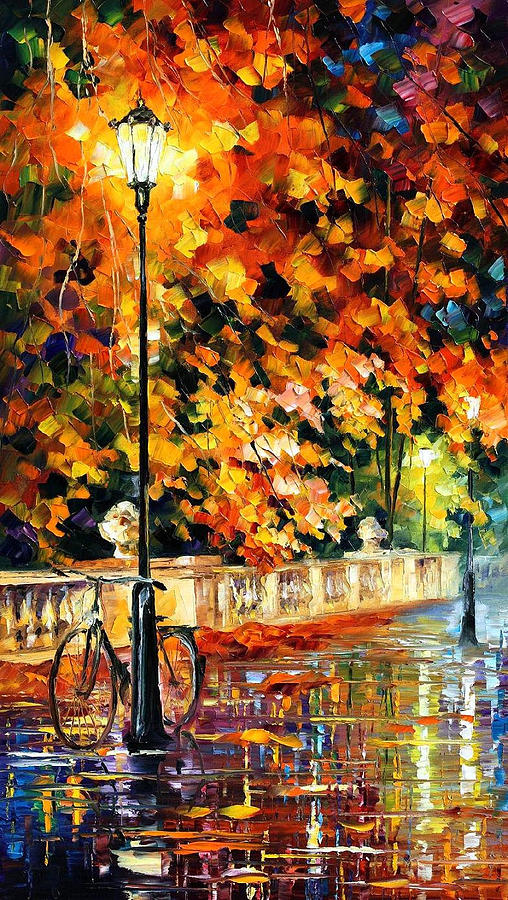
Locate an element on the screen. This screenshot has height=900, width=508. light is located at coordinates (140, 156), (470, 406).